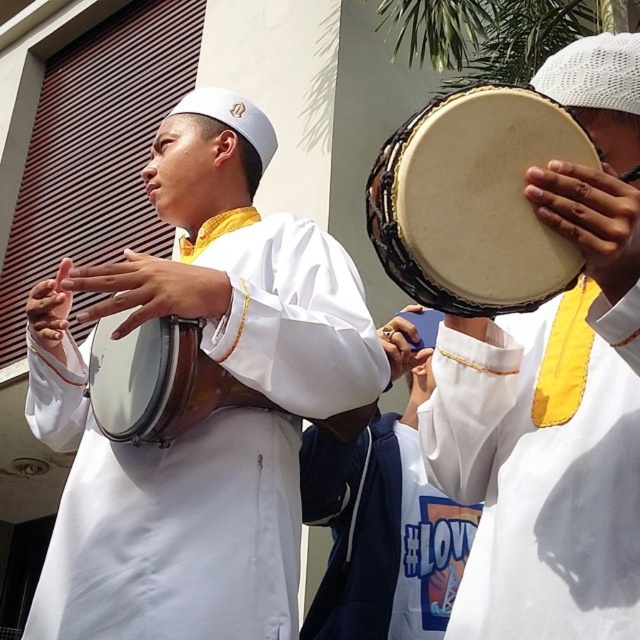
Is point (337, 634) less distant than point (120, 417)?

No.

Where is `white matte hoodie at center`? white matte hoodie at center is located at coordinates [x=380, y=536].

Can you confirm if matte white drum at center is taller than natural wood drum at center?

Correct, matte white drum at center is much taller as natural wood drum at center.

Is matte white drum at center thinner than natural wood drum at center?

In fact, matte white drum at center might be wider than natural wood drum at center.

Is point (112, 461) closer to viewer compared to point (520, 186)?

No, (112, 461) is further to viewer.

Where is `matte white drum at center`? This screenshot has width=640, height=640. matte white drum at center is located at coordinates (205, 419).

How far apart are matte white drum at center and white matte hoodie at center?

A distance of 38.18 feet exists between matte white drum at center and white matte hoodie at center.

Is matte white drum at center smaller than white matte hoodie at center?

No, matte white drum at center is not smaller than white matte hoodie at center.

Measure the distance between matte white drum at center and camera.

matte white drum at center and camera are 18.52 meters apart from each other.

The image size is (640, 640). I want to click on matte white drum at center, so click(x=205, y=419).